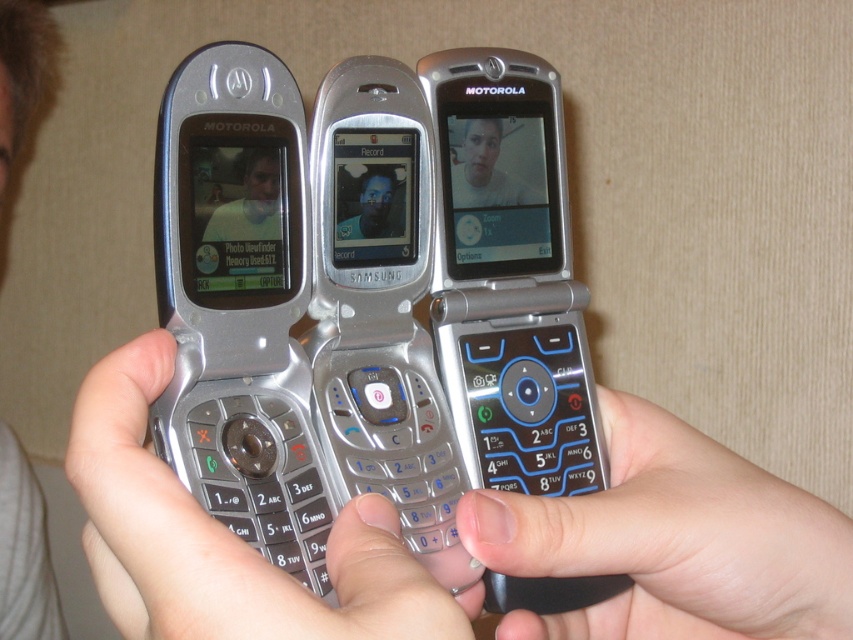
Question: Can you confirm if silver metallic motorola phone at center is smaller than black matte phone at center?

Choices:
 (A) yes
 (B) no

Answer: (A)

Question: Which of the following is the farthest from the observer?

Choices:
 (A) black matte phone at center
 (B) white matte face at center
 (C) matte silver phone at left

Answer: (B)

Question: Among these points, which one is farthest from the camera?

Choices:
 (A) (556, 220)
 (B) (306, 246)
 (C) (10, 436)

Answer: (C)

Question: Does silver metallic motorola phone at left have a lesser width compared to satin silver phone at center?

Choices:
 (A) yes
 (B) no

Answer: (B)

Question: Does silver metallic motorola phone at left have a greater width compared to matte silver phone at center?

Choices:
 (A) yes
 (B) no

Answer: (A)

Question: Estimate the real-world distances between objects in this image. Which object is closer to the matte silver phone at center?

Choices:
 (A) matte silver phone at left
 (B) silver metallic motorola phone at left

Answer: (A)